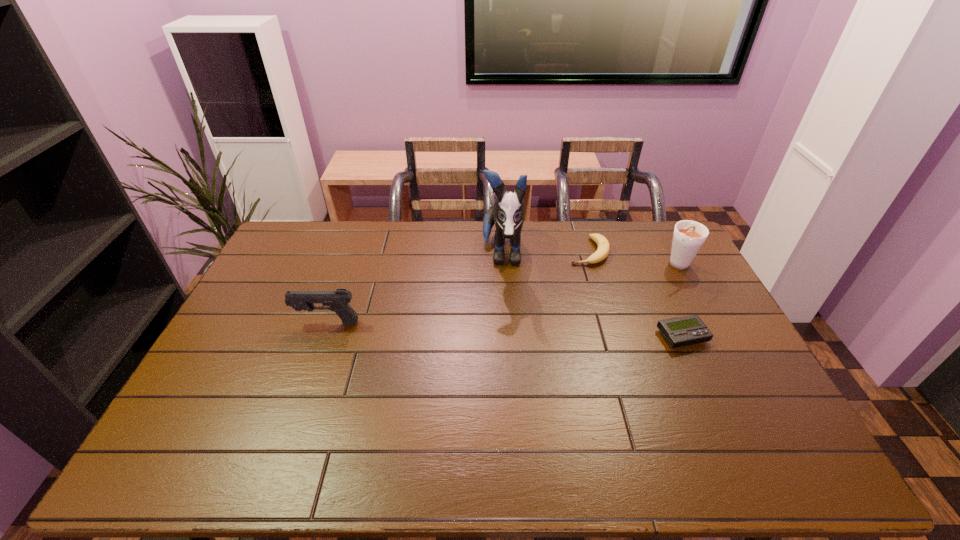
Identify the location of puppy that is at the far edge. (507, 212).

The image size is (960, 540). I want to click on banana at the far edge, so point(603,249).

This screenshot has height=540, width=960. Identify the location of root beer that is at the far edge. (688, 237).

Where is `beeper at the right edge`? Image resolution: width=960 pixels, height=540 pixels. beeper at the right edge is located at coordinates [683, 331].

This screenshot has width=960, height=540. Find the location of `root beer that is positioned at the right edge`. root beer that is positioned at the right edge is located at coordinates (688, 237).

You are a GUI agent. You are given a task and a screenshot of the screen. Output one action in this format:
    pyautogui.click(x=<x>, y=<y>)
    Task: Click on the object that is at the far right corner
    This screenshot has width=960, height=540.
    Given the screenshot: What is the action you would take?
    pyautogui.click(x=688, y=237)

Identify the location of vacant region at the far edge of the desktop. click(540, 230).

In the image, there is a desktop. At what (x,y) coordinates should I click in order to perform the action: click on blank space at the near edge. Please return your answer as a coordinate pair (x, y). This screenshot has height=540, width=960. Looking at the image, I should click on (532, 415).

Locate an element on the screen. This screenshot has height=540, width=960. vacant point at the left edge is located at coordinates (224, 346).

The height and width of the screenshot is (540, 960). In the image, there is a desktop. Identify the location of vacant space at the right edge. (685, 283).